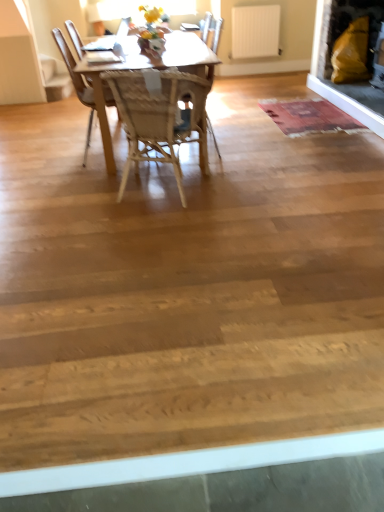
Locate an element on the screen. The width and height of the screenshot is (384, 512). free region on the left part of woven wood chair at center, which is the first chair from front to back is located at coordinates (79, 194).